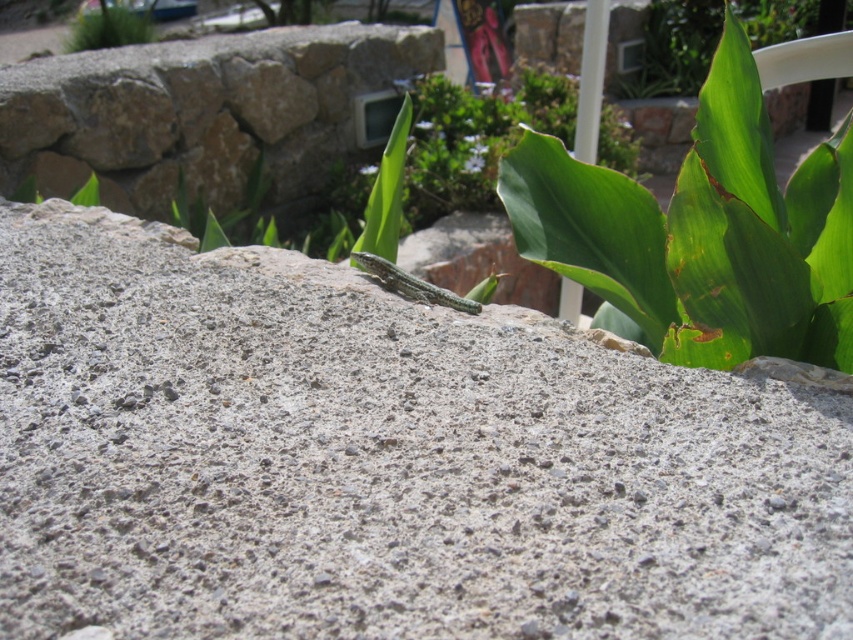
You are a photographer trying to capture the gray rough concrete at center and the green leafy plant at upper left in the same frame. Based on their positions, which object should you adjust your camera to focus on first to ensure both are in the frame?

The gray rough concrete at center is to the right of green leafy plant at upper left, so you should focus on the green leafy plant at upper left first to ensure both are in the frame.

You are a small insect trying to cross from the gray rough concrete at center to the green leafy plant at center right. Which direction should you move to reach the plant?

The green leafy plant at center right is located to the right of the gray rough concrete at center, so you should move towards the right direction to reach it.